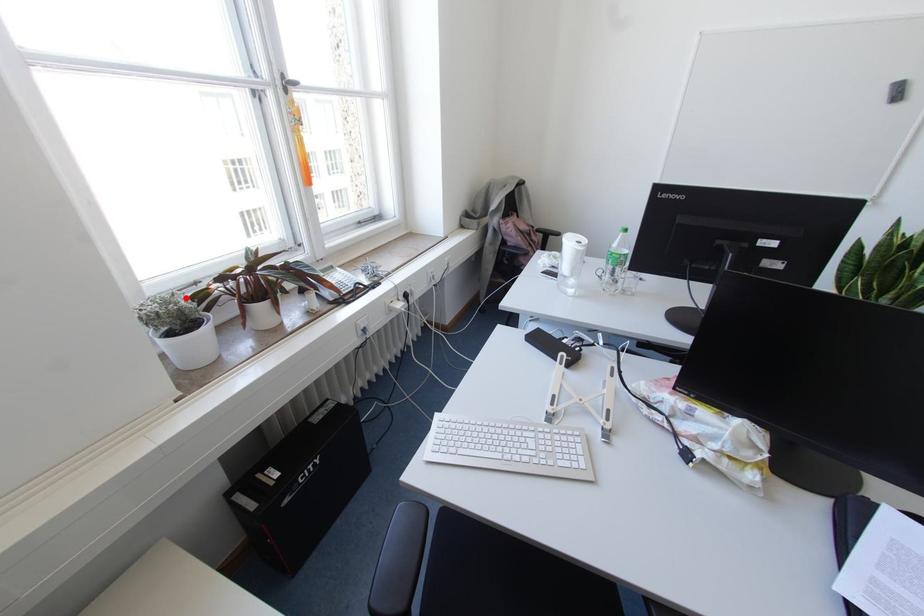
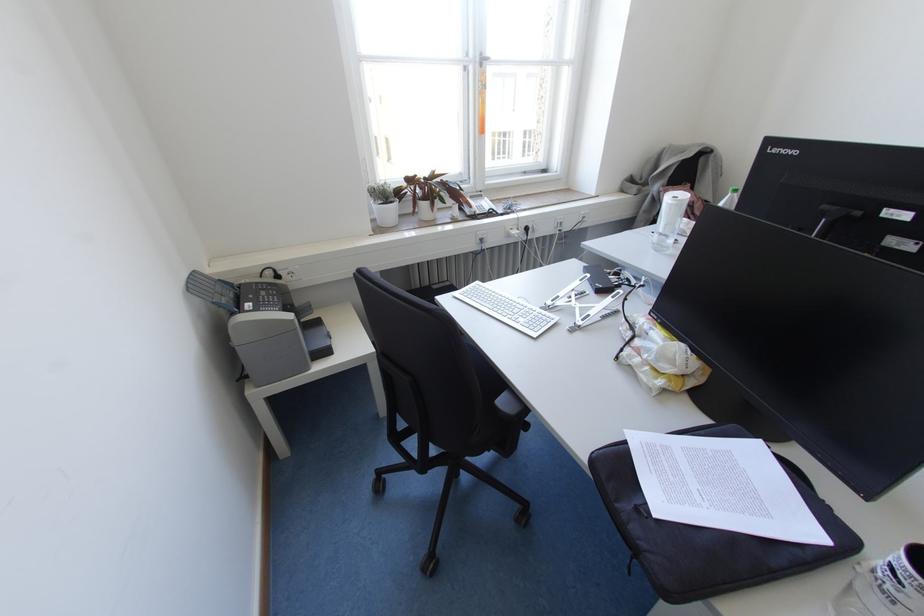
Find the pixel in the second image that matches the highlighted location in the first image.

(390, 187)